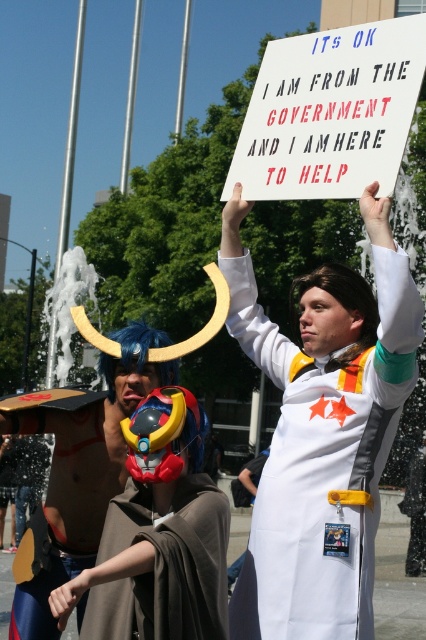
Does white fabric coat at center appear under white paper sign at upper center?

Yes, white fabric coat at center is below white paper sign at upper center.

What do you see at coordinates (322, 433) in the screenshot?
I see `white fabric coat at center` at bounding box center [322, 433].

Identify the location of white fabric coat at center. (322, 433).

Does white paper sign at upper center have a smaller size compared to shiny blue helmet at center?

Yes, white paper sign at upper center is smaller than shiny blue helmet at center.

Is point (365, 168) closer to viewer compared to point (66, 442)?

No, it is behind (66, 442).

Where is `white paper sign at upper center`? The height and width of the screenshot is (640, 426). white paper sign at upper center is located at coordinates [331, 113].

Measure the distance between point (x=149, y=605) and camera.

5.68 meters

Can you confirm if shiny plastic mask at center is wider than shiny blue helmet at center?

In fact, shiny plastic mask at center might be narrower than shiny blue helmet at center.

Locate an element on the screen. This screenshot has height=640, width=426. shiny plastic mask at center is located at coordinates (158, 536).